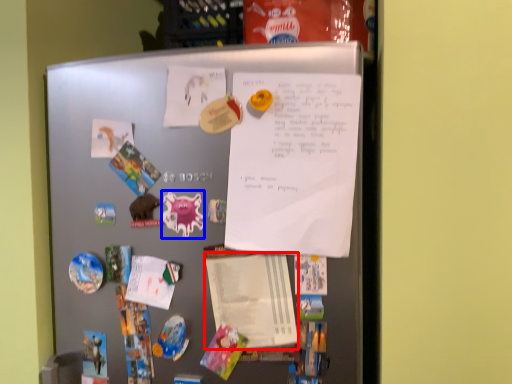
Question: Which point is closer to the camera, notepad (highlighted by a red box) or art (highlighted by a blue box)?

Choices:
 (A) notepad
 (B) art

Answer: (A)